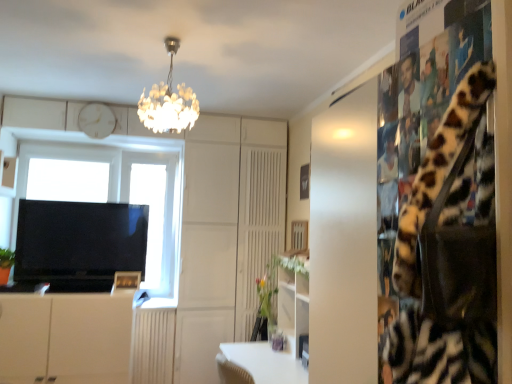
Question: From a real-world perspective, is green matte vase at center located beneath wooden picture frame at lower center?

Choices:
 (A) no
 (B) yes

Answer: (B)

Question: Can you confirm if green matte vase at center is positioned to the right of wooden picture frame at lower center?

Choices:
 (A) yes
 (B) no

Answer: (A)

Question: From a real-world perspective, does green matte vase at center stand above wooden picture frame at lower center?

Choices:
 (A) yes
 (B) no

Answer: (B)

Question: Can you confirm if green matte vase at center is shorter than wooden picture frame at lower center?

Choices:
 (A) yes
 (B) no

Answer: (B)

Question: Considering the relative positions of green matte vase at center and wooden picture frame at lower center in the image provided, is green matte vase at center in front of wooden picture frame at lower center?

Choices:
 (A) no
 (B) yes

Answer: (B)

Question: Is point (273, 256) closer or farther from the camera than point (89, 105)?

Choices:
 (A) closer
 (B) farther

Answer: (A)

Question: Do you think green matte vase at center is within white matte clock at upper center, or outside of it?

Choices:
 (A) outside
 (B) inside

Answer: (A)

Question: Looking at their shapes, would you say green matte vase at center is wider or thinner than white matte clock at upper center?

Choices:
 (A) thin
 (B) wide

Answer: (B)

Question: Based on their sizes in the image, would you say green matte vase at center is bigger or smaller than white matte clock at upper center?

Choices:
 (A) small
 (B) big

Answer: (B)

Question: Considering the positions of green matte vase at center and white matte cabinet at lower left in the image, is green matte vase at center taller or shorter than white matte cabinet at lower left?

Choices:
 (A) short
 (B) tall

Answer: (A)

Question: Considering the relative positions of green matte vase at center and white matte cabinet at lower left in the image provided, is green matte vase at center to the left or to the right of white matte cabinet at lower left?

Choices:
 (A) right
 (B) left

Answer: (A)

Question: From a real-world perspective, relative to white matte cabinet at lower left, is green matte vase at center vertically above or below?

Choices:
 (A) below
 (B) above

Answer: (B)

Question: Is green matte vase at center wider or thinner than white matte cabinet at lower left?

Choices:
 (A) wide
 (B) thin

Answer: (B)

Question: Is black glossy tv at left wider or thinner than wooden picture frame at lower center?

Choices:
 (A) wide
 (B) thin

Answer: (A)

Question: Would you say black glossy tv at left is to the left or to the right of wooden picture frame at lower center in the picture?

Choices:
 (A) left
 (B) right

Answer: (A)